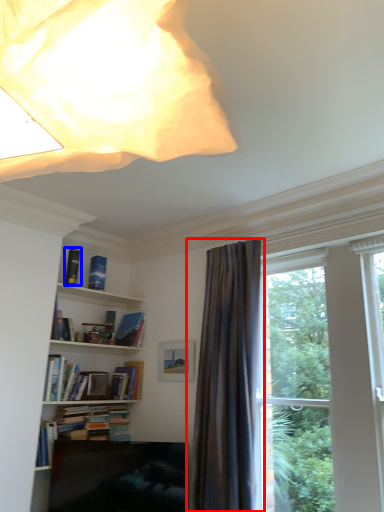
Question: Among these objects, which one is farthest to the camera, curtain (highlighted by a red box) or book (highlighted by a blue box)?

Choices:
 (A) curtain
 (B) book

Answer: (B)